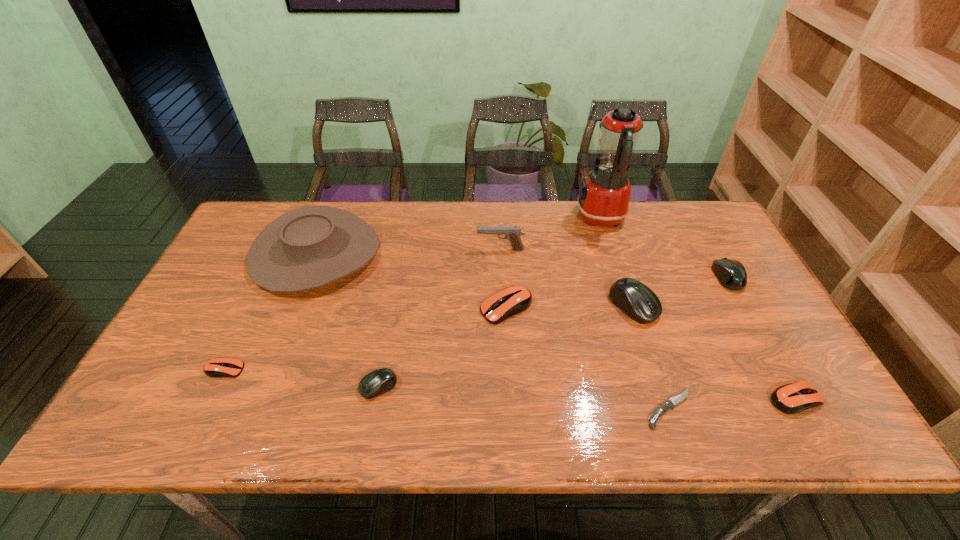
Identify the location of free space located 0.180m at the barrel of the pistol. (419, 249).

I want to click on free location located at the barrel of the pistol, so click(x=416, y=249).

Where is `free point located 0.280m at the barrel of the pistol`? This screenshot has height=540, width=960. free point located 0.280m at the barrel of the pistol is located at coordinates (387, 249).

At what (x,y) coordinates should I click in order to perform the action: click on vacant space situated 0.240m on the left of the biggest black mouse. Please return your answer as a coordinate pair (x, y). This screenshot has height=540, width=960. Looking at the image, I should click on (522, 306).

Where is `vacant space situated 0.170m on the back of the second biggest black mouse`? vacant space situated 0.170m on the back of the second biggest black mouse is located at coordinates (700, 227).

Locate an element on the screen. The width and height of the screenshot is (960, 540). vacant space located 0.150m on the front of the third computer mouse from left to right is located at coordinates pyautogui.click(x=510, y=374).

Locate an element on the screen. blank space located 0.050m on the left of the leftmost black mouse is located at coordinates (339, 387).

Identify the location of free spot located on the back of the fifth tallest computer mouse. (737, 296).

Where is `free space located on the back of the shortest computer mouse`? The width and height of the screenshot is (960, 540). free space located on the back of the shortest computer mouse is located at coordinates (276, 261).

Image resolution: width=960 pixels, height=540 pixels. I want to click on free space located 0.270m on the left of the pocketknife, so click(x=523, y=409).